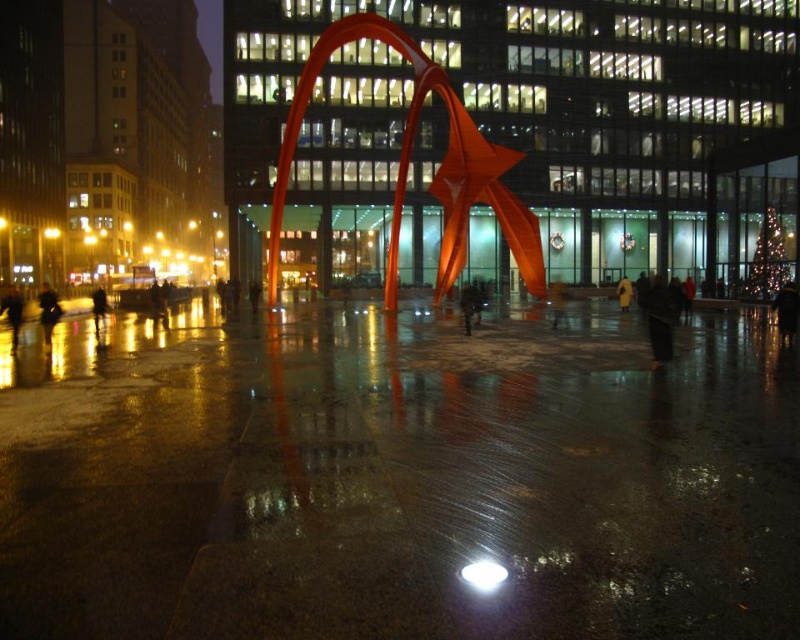
Looking at this image, you are a photographer standing at the edge of the plaza. You want to capture a photo that includes both the shiny orange sculpture at center and the dark gray coat at lower left. Since you want the sculpture to be the main focus, should you position the sculpture higher or lower in the frame compared to the coat?

The shiny orange sculpture at center is already positioned above the dark gray coat at lower left, so to keep it as the main focus, you should position the sculpture higher in the frame than the coat.

You are standing at the entrance of the building and see the shiny orange sculpture at center and the dark gray coat at lower left. Which object is closer to your right side?

The shiny orange sculpture at center is to the right of the dark gray coat at lower left, so it is closer to your right side.